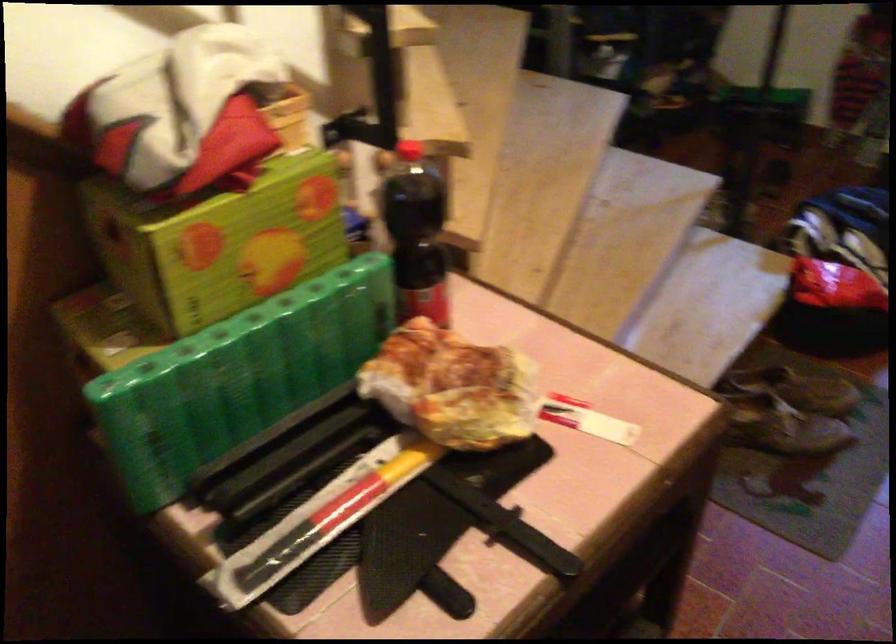
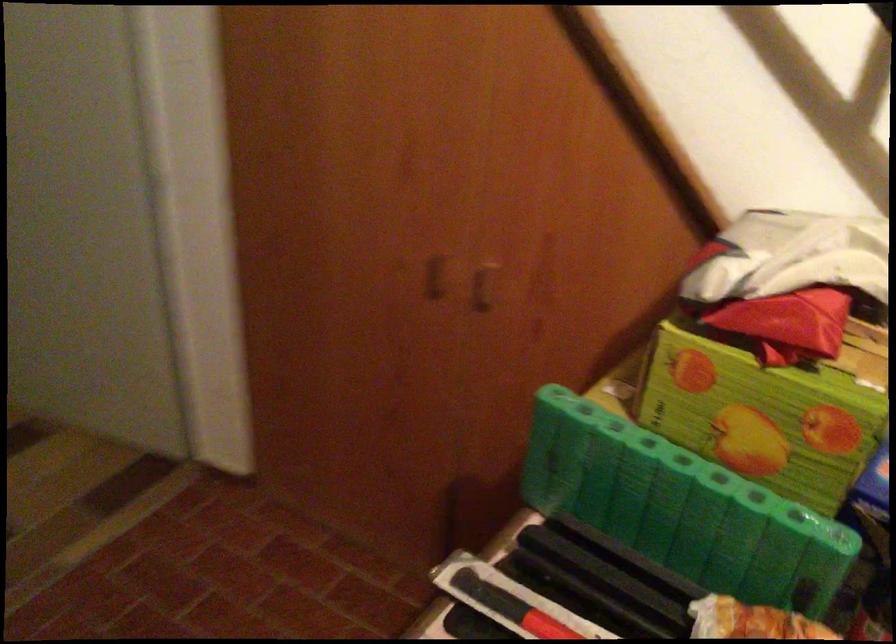
Locate, in the second image, the point that corresponds to the point at 303,540 in the first image.

(510, 605)